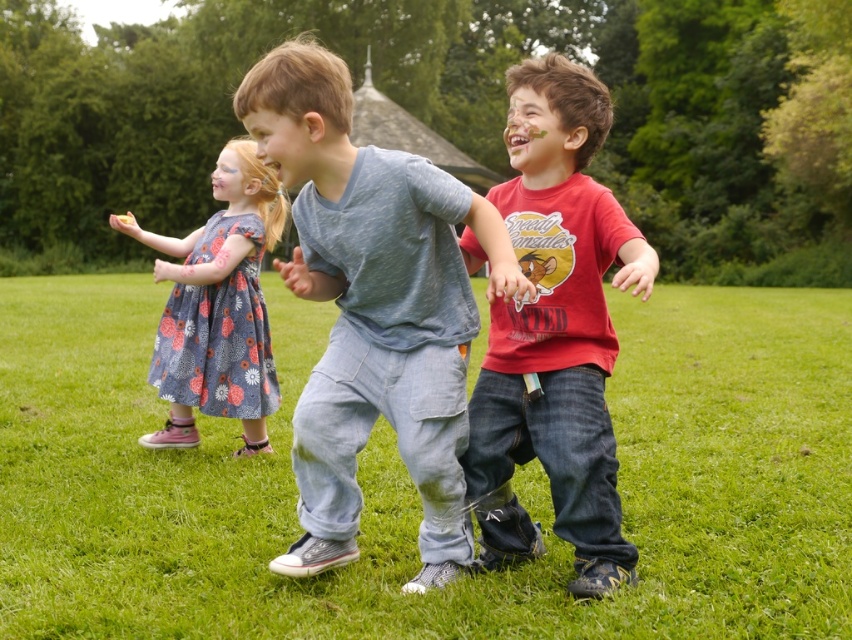
You are a photographer standing at the center of the grassy field. You want to take a photo of the denim pants at center. What are the coordinates where you should aim your camera?

The denim pants at center are located at coordinates point (413, 488). So you should aim your camera at point (413, 488) to capture the denim pants at center.